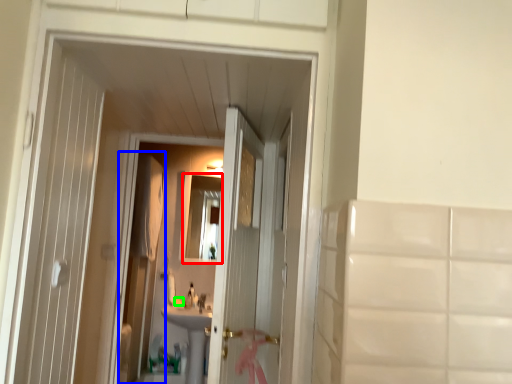
Question: Which is farther away from mirror (highlighted by a red box)? screen door (highlighted by a blue box) or soap (highlighted by a green box)?

Choices:
 (A) screen door
 (B) soap

Answer: (B)